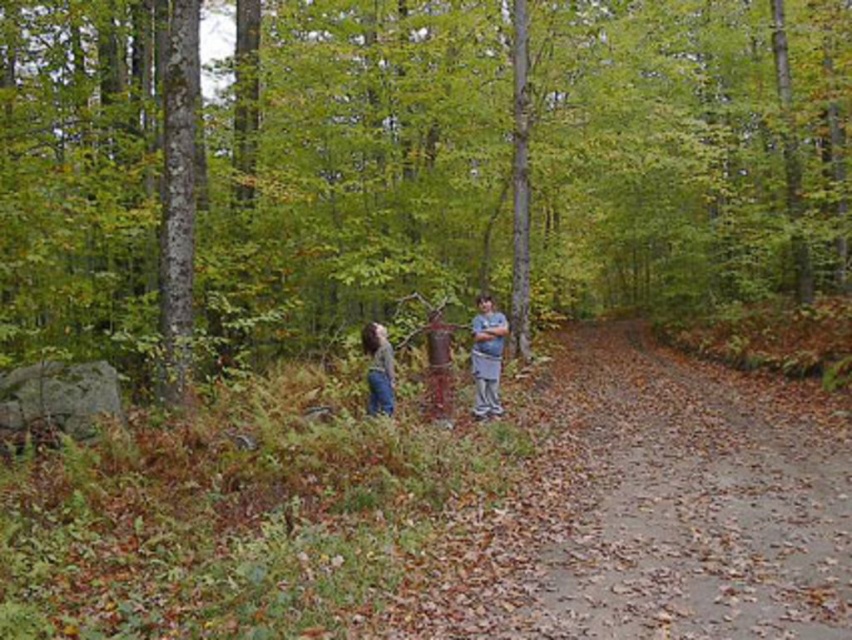
Question: Does green matte tree at center come behind denim jeans at center?

Choices:
 (A) no
 (B) yes

Answer: (B)

Question: Is green matte tree at center below gray cotton shirt at center?

Choices:
 (A) no
 (B) yes

Answer: (A)

Question: Can you confirm if green matte tree at center is thinner than gray cotton shirt at center?

Choices:
 (A) no
 (B) yes

Answer: (A)

Question: Which object is the closest to the gray cotton shirt at center?

Choices:
 (A) green matte tree at center
 (B) denim jeans at center

Answer: (B)

Question: Which of the following is the closest to the observer?

Choices:
 (A) (179, 88)
 (B) (488, 296)
 (C) (377, 324)

Answer: (C)

Question: Which object appears farthest from the camera in this image?

Choices:
 (A) gray cotton shirt at center
 (B) green matte tree at center
 (C) denim jeans at center

Answer: (A)